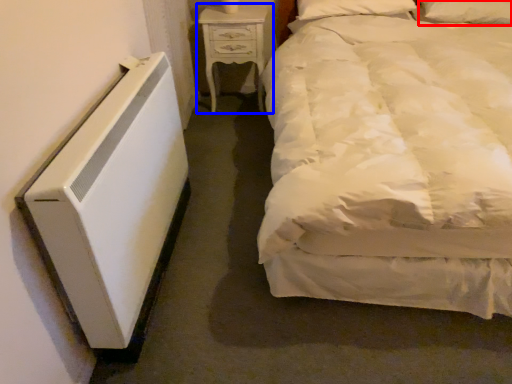
Question: Which object appears farthest to the camera in this image, pillow (highlighted by a red box) or nightstand (highlighted by a blue box)?

Choices:
 (A) pillow
 (B) nightstand

Answer: (B)